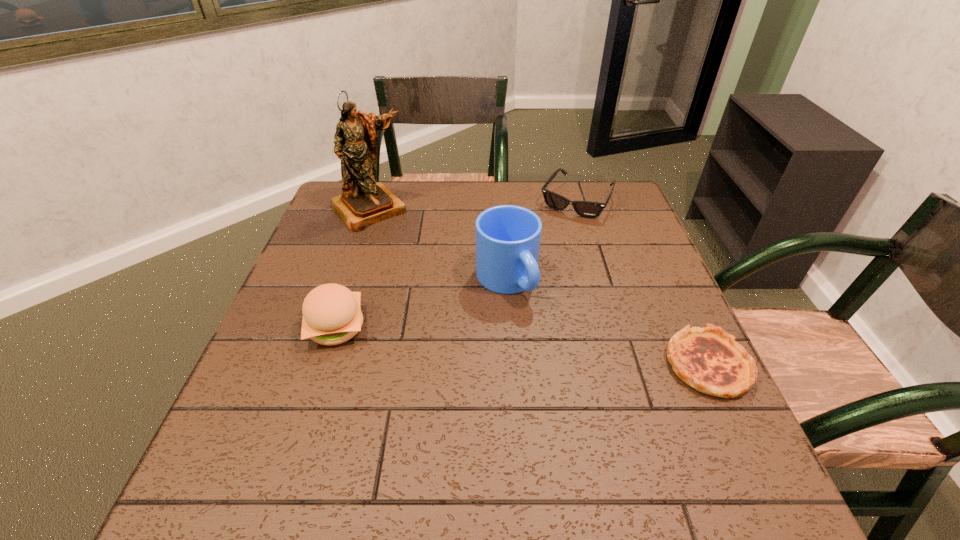
You are a GUI agent. You are given a task and a screenshot of the screen. Output one action in this format:
    pyautogui.click(x=<x>, y=<y>)
    Task: Click on the free spot on the desktop that is between the third shortest object and the quiche and is positioned on the front-facing side of the tallest object
    
    Given the screenshot: What is the action you would take?
    pyautogui.click(x=487, y=342)

Identify the location of vacant spot on the desktop that is between the hamburger and the shortest object and is positioned on the side of the mug with the handle. (564, 350).

Where is `free space on the desktop that is between the hamburger and the shortest object and is positioned on the front-facing side of the sunglasses`? free space on the desktop that is between the hamburger and the shortest object and is positioned on the front-facing side of the sunglasses is located at coordinates (486, 342).